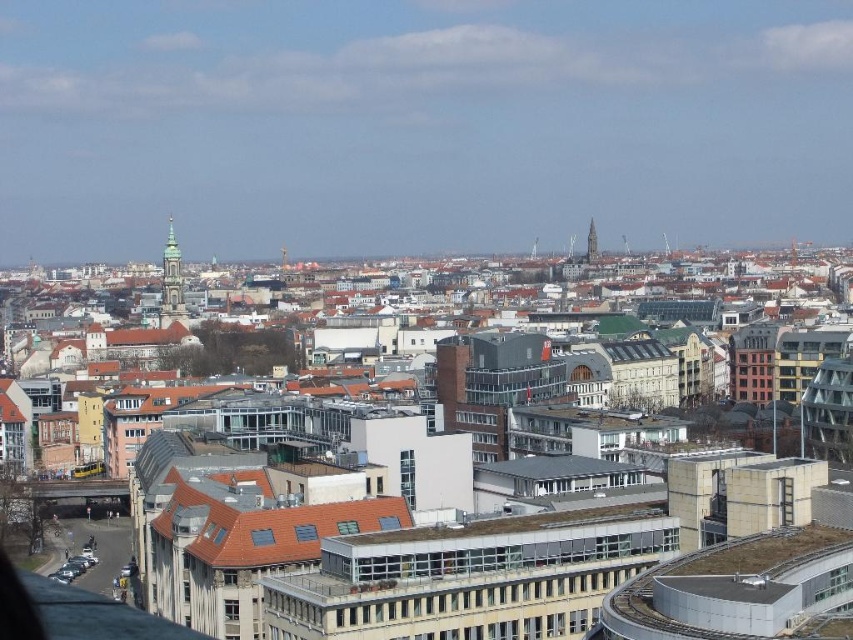
Question: Can you confirm if green stone spire at upper left is positioned above smooth stone tower at center?

Choices:
 (A) no
 (B) yes

Answer: (A)

Question: Among these objects, which one is nearest to the camera?

Choices:
 (A) green stone spire at upper left
 (B) smooth stone tower at center

Answer: (A)

Question: Does green stone spire at upper left appear under smooth stone tower at center?

Choices:
 (A) no
 (B) yes

Answer: (B)

Question: Which point is closer to the camera?

Choices:
 (A) (593, 224)
 (B) (160, 314)

Answer: (B)

Question: Does green stone spire at upper left come behind smooth stone tower at center?

Choices:
 (A) no
 (B) yes

Answer: (A)